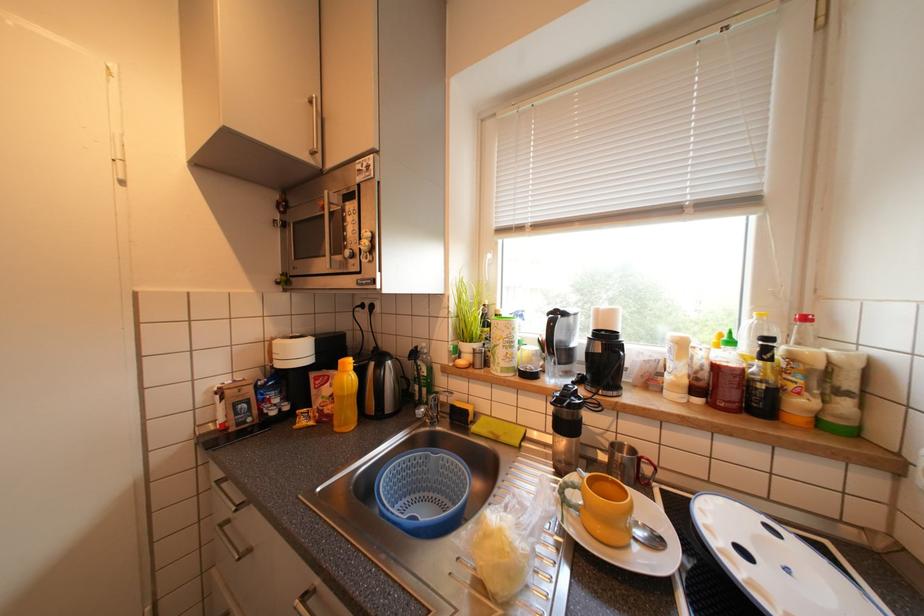
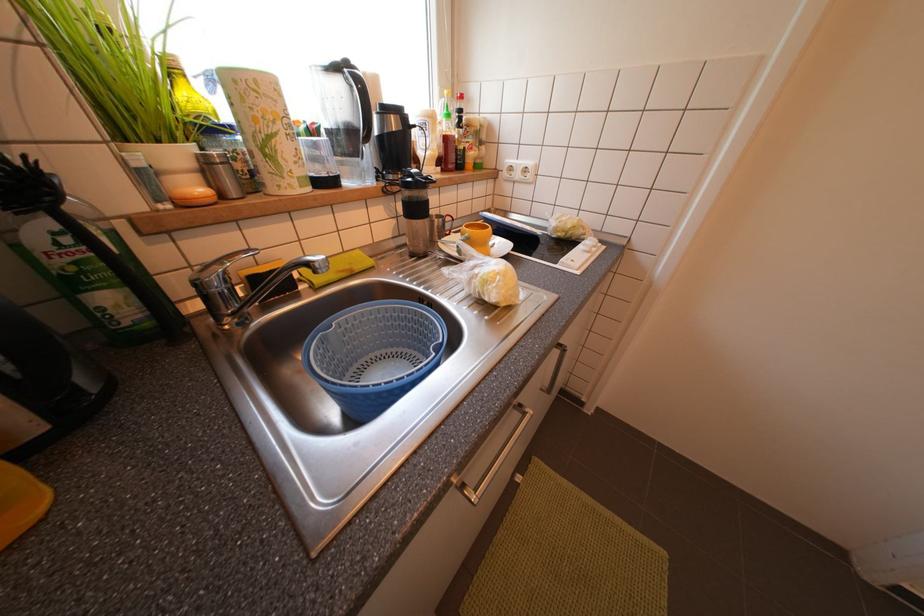
How did the camera likely rotate?

The camera rotated toward right-down.